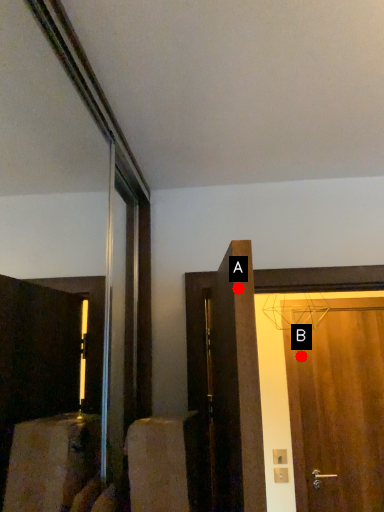
Question: Two points are circled on the image, labeled by A and B beside each circle. Which of the following is the farthest from the observer?

Choices:
 (A) A is further
 (B) B is further

Answer: (B)